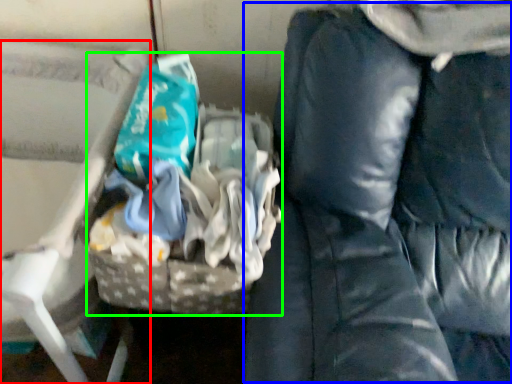
Question: Based on their relative distances, which object is farther from furniture (highlighted by a red box)? Choose from bean bag chair (highlighted by a blue box) and waste (highlighted by a green box).

Choices:
 (A) bean bag chair
 (B) waste

Answer: (A)